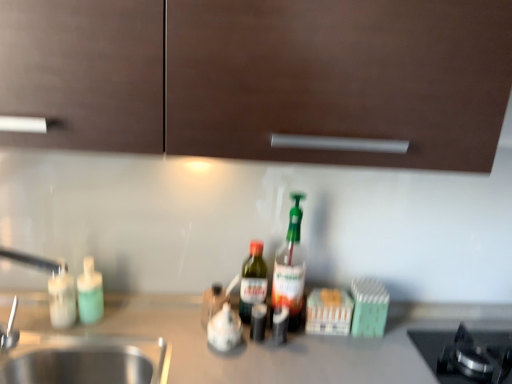
Question: Considering the relative positions of silver metallic faucet at left and green glass bottle at center, the third bottle positioned from the left, in the image provided, is silver metallic faucet at left to the left of green glass bottle at center, the third bottle positioned from the left, from the viewer's perspective?

Choices:
 (A) no
 (B) yes

Answer: (B)

Question: Can you confirm if silver metallic faucet at left is wider than green glass bottle at center, which is counted as the second bottle, starting from the right?

Choices:
 (A) yes
 (B) no

Answer: (A)

Question: Is silver metallic faucet at left to the right of green glass bottle at center, which is counted as the second bottle, starting from the right, from the viewer's perspective?

Choices:
 (A) yes
 (B) no

Answer: (B)

Question: Is silver metallic faucet at left shorter than green glass bottle at center, which is counted as the second bottle, starting from the right?

Choices:
 (A) no
 (B) yes

Answer: (A)

Question: Does silver metallic faucet at left have a greater height compared to green glass bottle at center, which is counted as the second bottle, starting from the right?

Choices:
 (A) no
 (B) yes

Answer: (B)

Question: In terms of height, does translucent plastic bottle at center, the first bottle in the right-to-left sequence, look taller or shorter compared to green glass bottle at center, the third bottle positioned from the left?

Choices:
 (A) short
 (B) tall

Answer: (B)

Question: From the image's perspective, is translucent plastic bottle at center, the first bottle in the right-to-left sequence, positioned above or below green glass bottle at center, which is counted as the second bottle, starting from the right?

Choices:
 (A) below
 (B) above

Answer: (B)

Question: Considering the positions of translucent plastic bottle at center, the 4th bottle viewed from the left, and green glass bottle at center, which is counted as the second bottle, starting from the right, in the image, is translucent plastic bottle at center, the 4th bottle viewed from the left, wider or thinner than green glass bottle at center, which is counted as the second bottle, starting from the right,?

Choices:
 (A) wide
 (B) thin

Answer: (A)

Question: Choose the correct answer: Is translucent plastic bottle at center, the 4th bottle viewed from the left, inside green glass bottle at center, which is counted as the second bottle, starting from the right, or outside it?

Choices:
 (A) outside
 (B) inside

Answer: (A)

Question: From a real-world perspective, is green glass bottle at center, which is counted as the second bottle, starting from the right, positioned above or below white glossy soap dispenser at left, arranged as the first bottle when viewed from the left?

Choices:
 (A) above
 (B) below

Answer: (A)

Question: Looking at the image, does green glass bottle at center, the third bottle positioned from the left, seem bigger or smaller compared to white glossy soap dispenser at left, placed as the fourth bottle when sorted from right to left?

Choices:
 (A) small
 (B) big

Answer: (B)

Question: Based on their positions, is green glass bottle at center, which is counted as the second bottle, starting from the right, located to the left or right of white glossy soap dispenser at left, placed as the fourth bottle when sorted from right to left?

Choices:
 (A) right
 (B) left

Answer: (A)

Question: Is point (262, 264) closer or farther from the camera than point (51, 283)?

Choices:
 (A) farther
 (B) closer

Answer: (A)

Question: From the image's perspective, relative to silver metallic faucet at left, is matte green soap dispenser at left, which is the third bottle from right to left, above or below?

Choices:
 (A) below
 (B) above

Answer: (A)

Question: In terms of width, does matte green soap dispenser at left, which is the third bottle from right to left, look wider or thinner when compared to silver metallic faucet at left?

Choices:
 (A) wide
 (B) thin

Answer: (B)